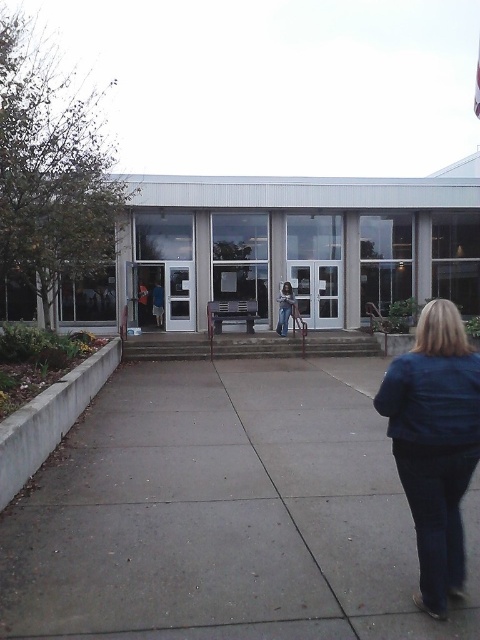
Question: Which of the following is the closest to the observer?

Choices:
 (A) (115, 515)
 (B) (282, 285)
 (C) (394, 232)

Answer: (A)

Question: Which of these objects is positioned farthest from the gray concrete pavement at center?

Choices:
 (A) blue leather jacket at lower right
 (B) clear glass storefront at center
 (C) blue jeans at center

Answer: (B)

Question: Can you confirm if clear glass storefront at center is positioned to the right of blue jeans at center?

Choices:
 (A) yes
 (B) no

Answer: (A)

Question: Based on their relative distances, which object is farther from the blue jeans at center?

Choices:
 (A) clear glass storefront at center
 (B) gray concrete pavement at center
 (C) blue leather jacket at lower right

Answer: (C)

Question: Does gray concrete pavement at center appear over clear glass storefront at center?

Choices:
 (A) yes
 (B) no

Answer: (B)

Question: Does gray concrete pavement at center come behind blue leather jacket at lower right?

Choices:
 (A) no
 (B) yes

Answer: (B)